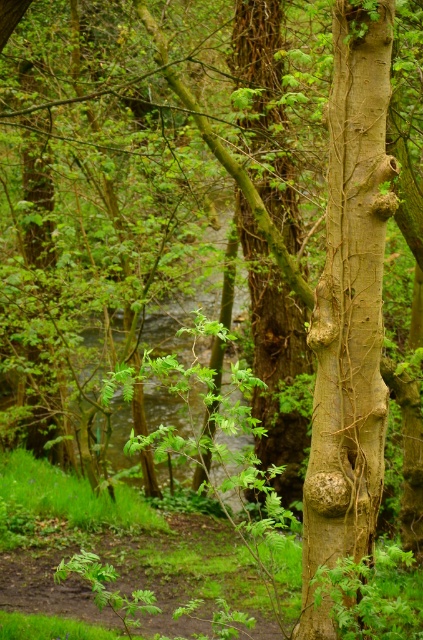
Question: Is smooth brown bark at right smaller than green rough bark tree trunk at center?

Choices:
 (A) no
 (B) yes

Answer: (B)

Question: In this image, where is smooth brown bark at right located relative to green rough bark tree trunk at center?

Choices:
 (A) below
 (B) above

Answer: (A)

Question: Can you confirm if smooth brown bark at right is positioned to the left of green rough bark tree trunk at center?

Choices:
 (A) no
 (B) yes

Answer: (A)

Question: Which point is farther to the camera?

Choices:
 (A) green rough bark tree trunk at center
 (B) smooth brown bark at right

Answer: (A)